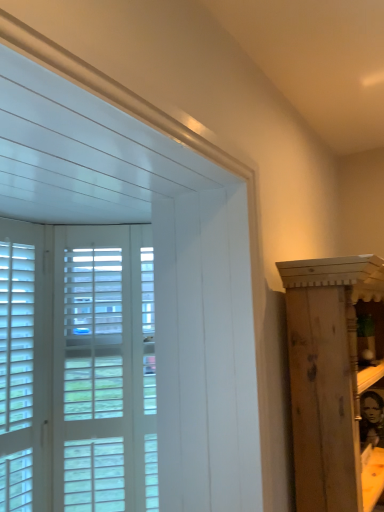
Question: Does white wood window at left have a larger size compared to white wood screen door at left?

Choices:
 (A) no
 (B) yes

Answer: (A)

Question: From the image's perspective, is white wood window at left on top of white wood screen door at left?

Choices:
 (A) yes
 (B) no

Answer: (A)

Question: Is white wood screen door at left located within white wood window at left?

Choices:
 (A) no
 (B) yes

Answer: (A)

Question: Is white wood window at left facing towards white wood screen door at left?

Choices:
 (A) yes
 (B) no

Answer: (B)

Question: Does white wood window at left have a greater height compared to white wood screen door at left?

Choices:
 (A) yes
 (B) no

Answer: (B)

Question: Is white wood window at left positioned with its back to white wood screen door at left?

Choices:
 (A) yes
 (B) no

Answer: (B)

Question: Is white wood screen door at left placed right next to wooden cabinet at right?

Choices:
 (A) yes
 (B) no

Answer: (B)

Question: Considering the relative sizes of white wood screen door at left and wooden cabinet at right in the image provided, is white wood screen door at left smaller than wooden cabinet at right?

Choices:
 (A) no
 (B) yes

Answer: (B)

Question: From the image's perspective, is white wood screen door at left on wooden cabinet at right?

Choices:
 (A) no
 (B) yes

Answer: (B)

Question: Considering the relative sizes of white wood screen door at left and wooden cabinet at right in the image provided, is white wood screen door at left thinner than wooden cabinet at right?

Choices:
 (A) yes
 (B) no

Answer: (A)

Question: From a real-world perspective, is white wood screen door at left beneath wooden cabinet at right?

Choices:
 (A) yes
 (B) no

Answer: (B)

Question: From a real-world perspective, is white wood screen door at left positioned over wooden cabinet at right based on gravity?

Choices:
 (A) yes
 (B) no

Answer: (A)

Question: Is wooden cabinet at right oriented away from white wood window at left?

Choices:
 (A) yes
 (B) no

Answer: (A)